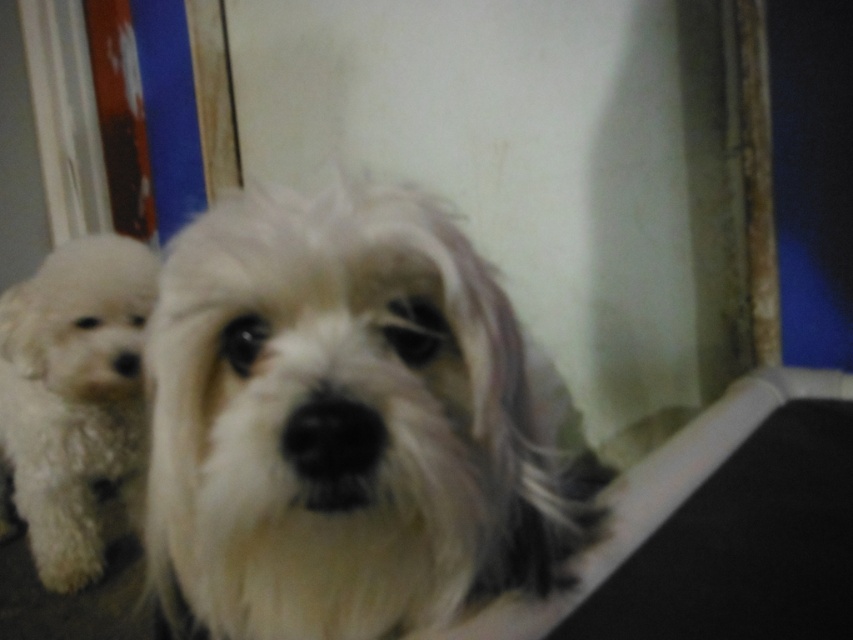
Question: Considering the relative positions of white fluffy dog at center and white fluffy dog at left in the image provided, where is white fluffy dog at center located with respect to white fluffy dog at left?

Choices:
 (A) above
 (B) below

Answer: (A)

Question: Which point is farther to the camera?

Choices:
 (A) 126,244
 (B) 468,260

Answer: (A)

Question: Does white fluffy dog at center come behind white fluffy dog at left?

Choices:
 (A) yes
 (B) no

Answer: (B)

Question: Which of the following is the farthest from the observer?

Choices:
 (A) (82, 452)
 (B) (403, 220)

Answer: (A)

Question: Which object appears farthest from the camera in this image?

Choices:
 (A) white fluffy dog at center
 (B) white fluffy dog at left

Answer: (B)

Question: Is white fluffy dog at center positioned behind white fluffy dog at left?

Choices:
 (A) yes
 (B) no

Answer: (B)